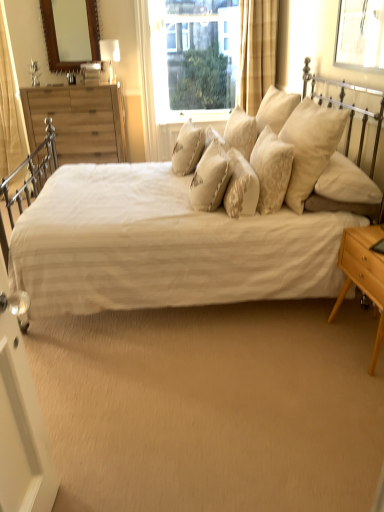
At what (x,y) coordinates should I click in order to perform the action: click on vacant area that lies between white glossy screen door at lower left and light wood/texture nightstand at lower right. Please return your answer as a coordinate pair (x, y). Looking at the image, I should click on (241, 409).